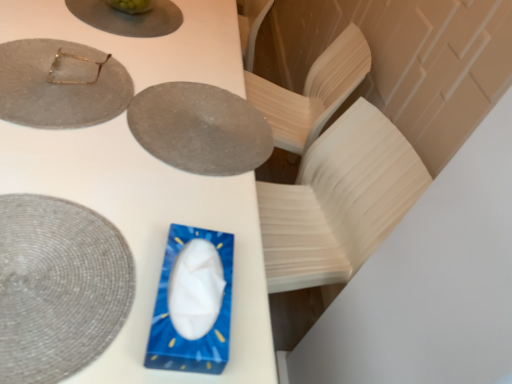
Locate an element on the screen. The width and height of the screenshot is (512, 384). empty space that is in between matte gray placemat at lower left, marked as the first plate in a bottom-to-top arrangement, and matte gray plate at upper center, placed as the third plate when sorted from top to bottom is located at coordinates (133, 185).